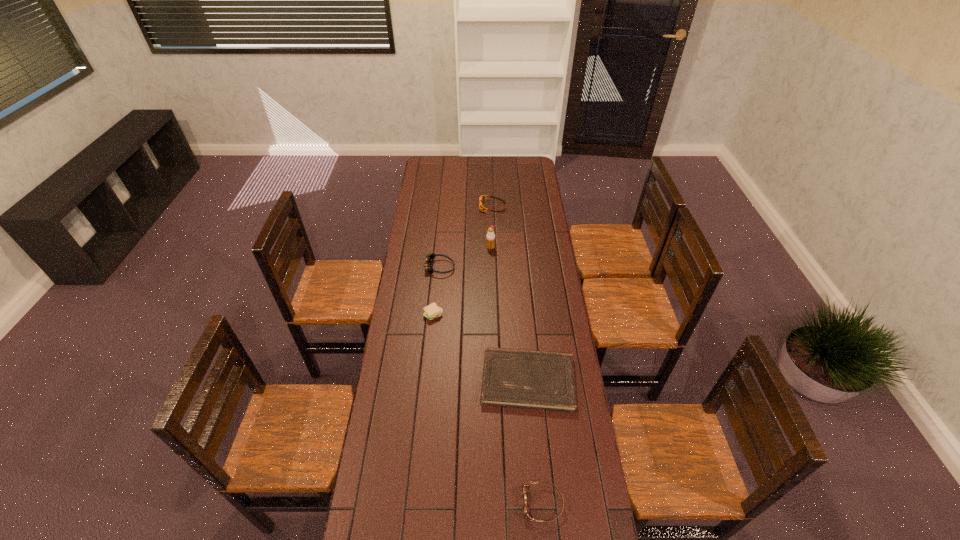
This screenshot has width=960, height=540. I want to click on patty that is at the left edge, so click(x=432, y=311).

Where is `goggles that is positioned at the right edge`? goggles that is positioned at the right edge is located at coordinates (526, 509).

Image resolution: width=960 pixels, height=540 pixels. What are the coordinates of `paperback book located at the right edge` in the screenshot? It's located at coord(545,380).

Where is `free region at the far edge of the desktop`? The image size is (960, 540). free region at the far edge of the desktop is located at coordinates (451, 159).

Locate an element on the screen. vacant space at the left edge of the desktop is located at coordinates (378, 441).

Locate an element on the screen. The height and width of the screenshot is (540, 960). vacant space at the right edge of the desktop is located at coordinates (525, 187).

In the image, there is a desktop. Where is `free space at the far left corner`? The height and width of the screenshot is (540, 960). free space at the far left corner is located at coordinates (423, 163).

Find the location of a particular element. The image size is (960, 540). free point at the far right corner is located at coordinates (523, 167).

Identify the location of free space between the second farthest object and the leftmost goggles. This screenshot has width=960, height=540. (465, 258).

You are a GUI agent. You are given a task and a screenshot of the screen. Output one action in this format:
    pyautogui.click(x=<x>, y=<y>)
    Task: Click on the free space between the patty and the nearest object
    The width and height of the screenshot is (960, 540).
    Given the screenshot: What is the action you would take?
    pyautogui.click(x=488, y=409)